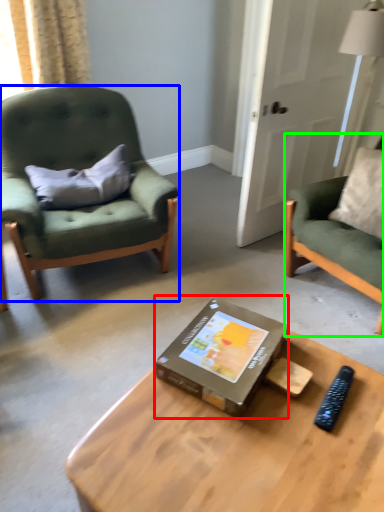
Question: Estimate the real-world distances between objects in this image. Which object is closer to box (highlighted by a red box), chair (highlighted by a blue box) or chair (highlighted by a green box)?

Choices:
 (A) chair
 (B) chair

Answer: (B)